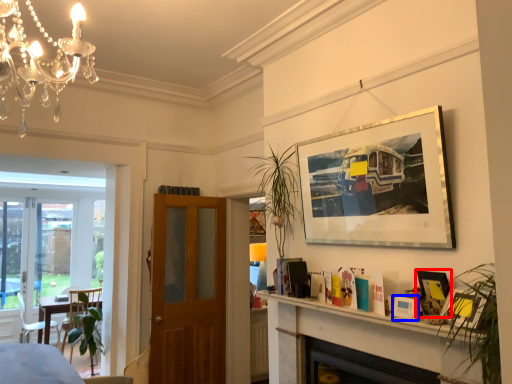
Question: Which point is further to the camera, picture frame (highlighted by a red box) or picture frame (highlighted by a blue box)?

Choices:
 (A) picture frame
 (B) picture frame

Answer: (A)